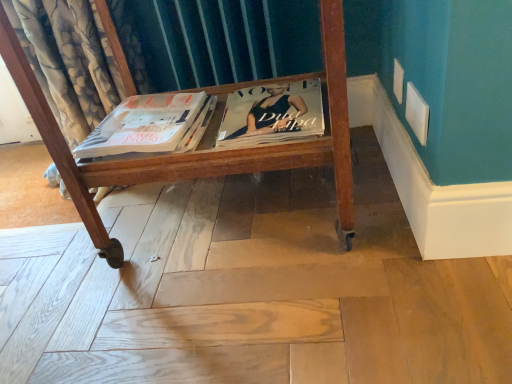
Question: Considering the relative positions of wooden cart at center and matte black magazine at center in the image provided, is wooden cart at center to the left or to the right of matte black magazine at center?

Choices:
 (A) right
 (B) left

Answer: (B)

Question: From the image's perspective, is wooden cart at center positioned above or below matte black magazine at center?

Choices:
 (A) below
 (B) above

Answer: (A)

Question: Which object is positioned farthest from the wooden cart at center?

Choices:
 (A) matte white magazine at center
 (B) matte black magazine at center

Answer: (B)

Question: Estimate the real-world distances between objects in this image. Which object is closer to the matte black magazine at center?

Choices:
 (A) matte white magazine at center
 (B) wooden cart at center

Answer: (B)